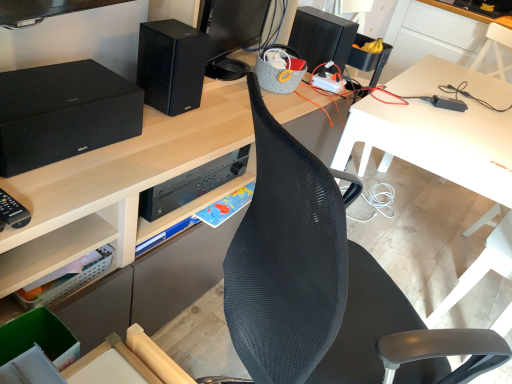
Question: Considering the relative positions of black mesh chair at center and black matte speaker at upper right, acting as the 3th speaker starting from the front, in the image provided, is black mesh chair at center to the left or to the right of black matte speaker at upper right, acting as the 3th speaker starting from the front,?

Choices:
 (A) left
 (B) right

Answer: (A)

Question: Is point (224, 263) positioned closer to the camera than point (326, 51)?

Choices:
 (A) farther
 (B) closer

Answer: (B)

Question: Estimate the real-world distances between objects in this image. Which object is farther from the clear plastic basket at lower left?

Choices:
 (A) black matte speaker at upper right, marked as the 1th speaker in a right-to-left arrangement
 (B) white plastic table at center, which ranks as the 1th table in bottom-to-top order
 (C) black mesh chair at center
 (D) matte black speaker at left, arranged as the 3th speaker when viewed from the back
 (E) white plastic table at upper right, placed as the first table when sorted from top to bottom

Answer: (E)

Question: Which is farther from the white plastic table at upper right, which is counted as the 2th table, starting from the front?

Choices:
 (A) black matte speaker at upper right, marked as the 1th speaker in a right-to-left arrangement
 (B) black mesh chair at center
 (C) matte black speaker at left, the first speaker positioned from the front
 (D) white plastic table at center, which ranks as the 1th table in bottom-to-top order
 (E) black matte speaker at upper center, which ranks as the second speaker in right-to-left order

Answer: (C)